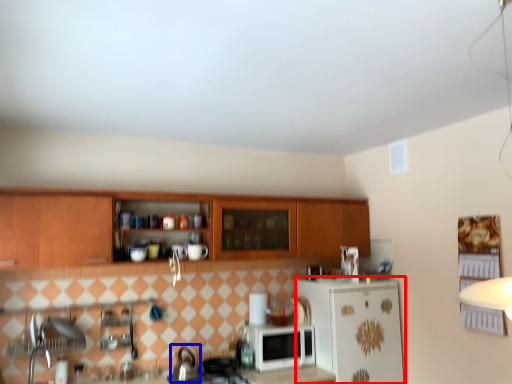
Question: Among these objects, which one is nearest to the camera, refrigerator (highlighted by a red box) or tea pot (highlighted by a blue box)?

Choices:
 (A) refrigerator
 (B) tea pot

Answer: (B)